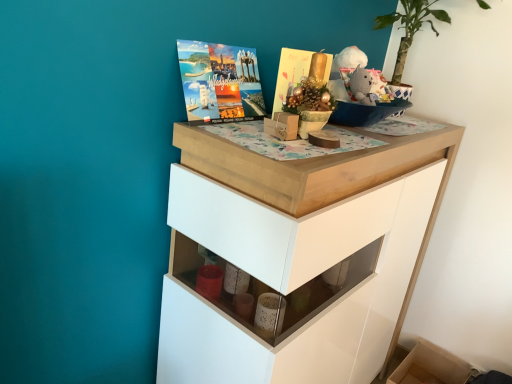
You are a GUI agent. You are given a task and a screenshot of the screen. Output one action in this format:
    pyautogui.click(x=<x>, y=<y>)
    Task: Click on the free point in front of matte brown box at center
    The width and height of the screenshot is (512, 384).
    Given the screenshot: What is the action you would take?
    pyautogui.click(x=281, y=152)